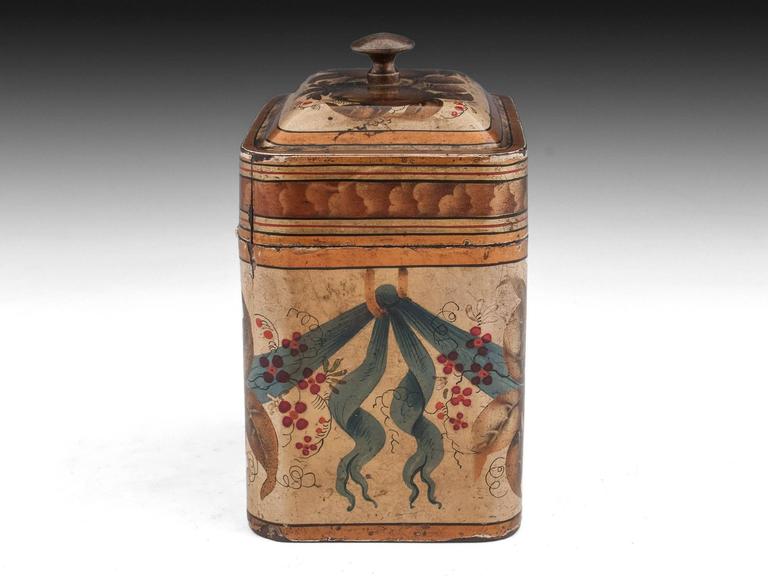
Where is `handle`? handle is located at coordinates (378, 51).